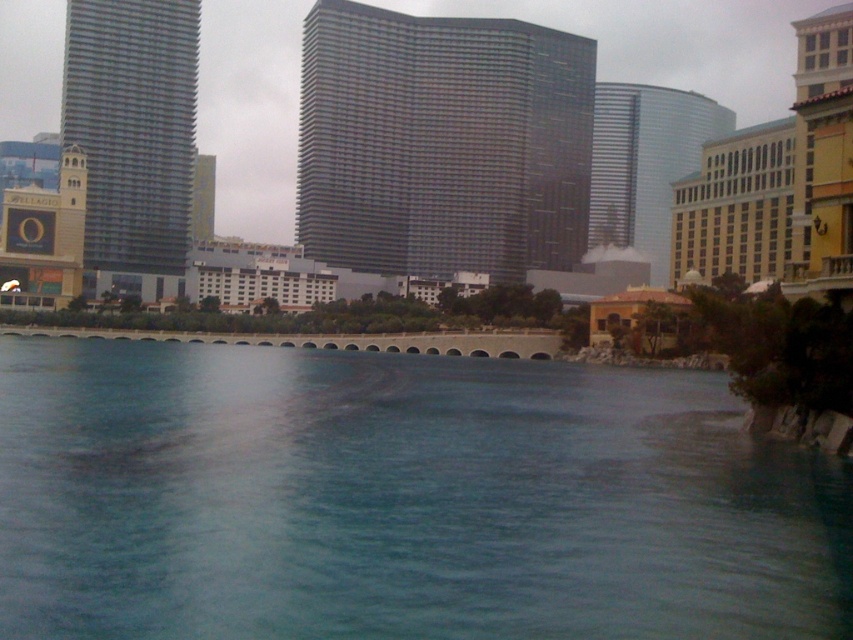
Question: Which point is closer to the camera?

Choices:
 (A) (102, 58)
 (B) (254, 484)

Answer: (B)

Question: Which point is farther from the camera taking this photo?

Choices:
 (A) (683, 212)
 (B) (129, 164)

Answer: (A)

Question: Is the position of glassy metallic skyscraper at center more distant than that of glassy steel skyscraper at left?

Choices:
 (A) yes
 (B) no

Answer: (A)

Question: Is glassy steel skyscraper at left below glassy reflective skyscraper at center?

Choices:
 (A) yes
 (B) no

Answer: (A)

Question: Among these objects, which one is nearest to the camera?

Choices:
 (A) glassy reflective skyscraper at center
 (B) gold/brick hotel at right

Answer: (B)

Question: Can you confirm if glassy metallic skyscraper at center is wider than glassy reflective skyscraper at center?

Choices:
 (A) yes
 (B) no

Answer: (A)